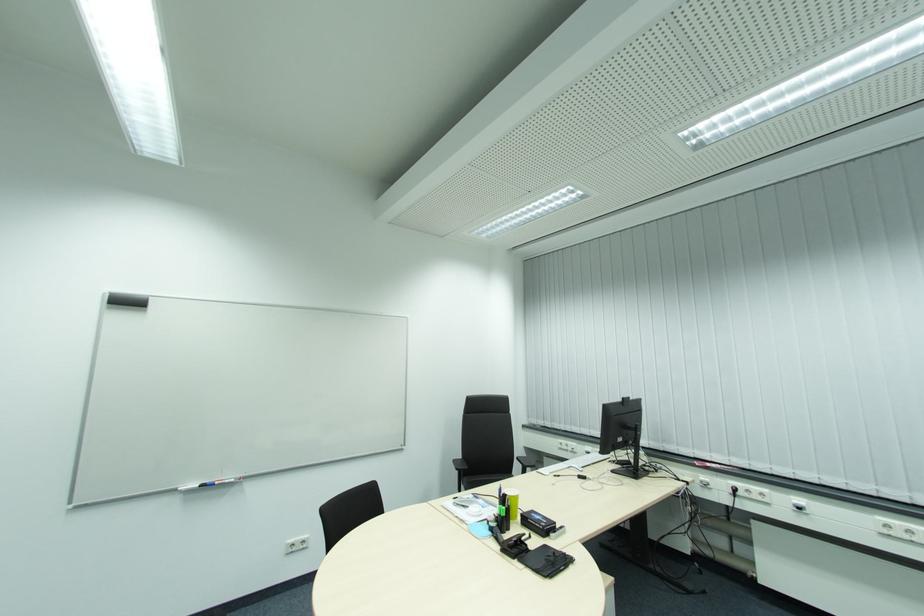
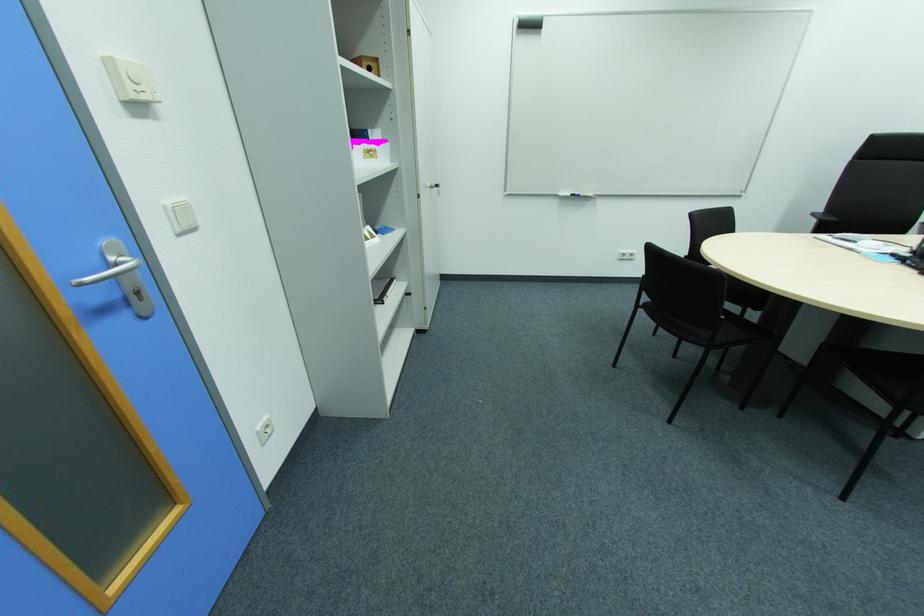
In the second image, find the point that corresponds to point (223, 483) in the first image.

(588, 195)